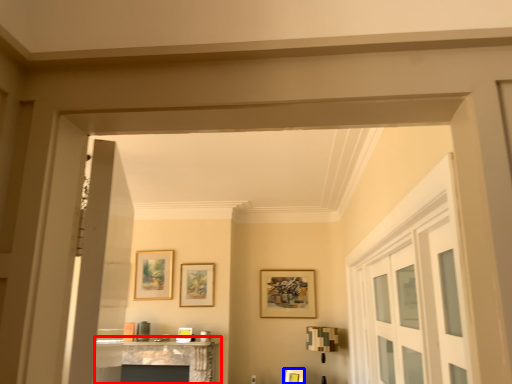
Question: Which point is closer to the camera, table (highlighted by a red box) or picture frame (highlighted by a blue box)?

Choices:
 (A) table
 (B) picture frame

Answer: (A)